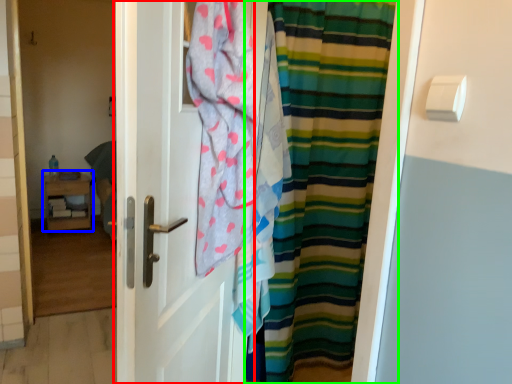
Question: Which object is positioned closest to door (highlighted by a red box)? Select from furniture (highlighted by a blue box) and curtain (highlighted by a green box).

Choices:
 (A) furniture
 (B) curtain

Answer: (B)